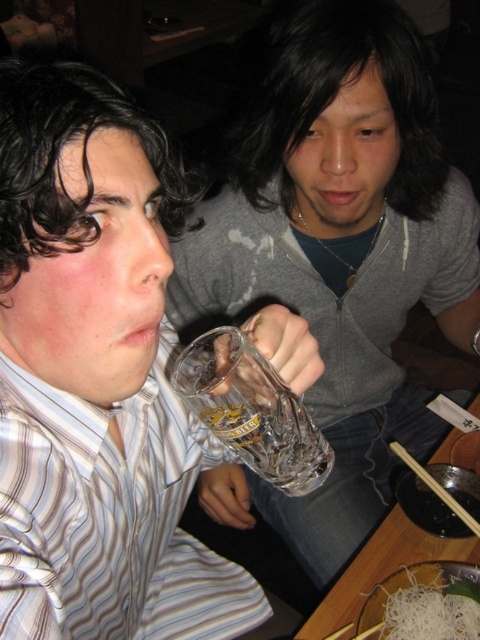
Which is above, transparent glass mug at upper center or clear glass beer at center?

transparent glass mug at upper center

Is transparent glass mug at upper center above clear glass beer at center?

Yes, transparent glass mug at upper center is above clear glass beer at center.

Is point (208, 492) farther from camera compared to point (300, 436)?

Yes, it is.

Locate an element on the screen. Image resolution: width=480 pixels, height=640 pixels. transparent glass mug at upper center is located at coordinates (339, 248).

Is clear glass mug at left positioned at the back of transparent glass mug at upper center?

No, clear glass mug at left is in front of transparent glass mug at upper center.

Is point (39, 365) more distant than point (324, 212)?

No, (39, 365) is closer to viewer.

Between point (48, 204) and point (288, 116), which one is positioned in front?

Point (48, 204) is in front.

This screenshot has height=640, width=480. What are the coordinates of `clear glass mug at left` in the screenshot? It's located at (96, 378).

You are a GUI agent. You are given a task and a screenshot of the screen. Output one action in this format:
    pyautogui.click(x=<x>, y=<y>)
    Task: Click on the transparent glass mug at upper center
    This screenshot has height=640, width=480.
    Given the screenshot: What is the action you would take?
    pyautogui.click(x=339, y=248)

Does transparent glass mug at upper center appear on the right side of wooden chopsticks at lower right?

Incorrect, transparent glass mug at upper center is not on the right side of wooden chopsticks at lower right.

Is point (418, 115) positioned behind point (402, 454)?

That is False.

This screenshot has width=480, height=640. I want to click on transparent glass mug at upper center, so click(339, 248).